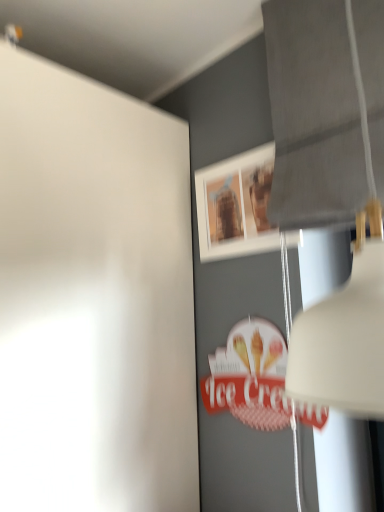
Question: In the image, is matte wooden picture frame at upper center positioned in front of or behind white matte lampshade at upper right?

Choices:
 (A) front
 (B) behind

Answer: (B)

Question: Is matte wooden picture frame at upper center bigger or smaller than white matte lampshade at upper right?

Choices:
 (A) big
 (B) small

Answer: (B)

Question: Looking at their shapes, would you say matte wooden picture frame at upper center is wider or thinner than white matte lampshade at upper right?

Choices:
 (A) thin
 (B) wide

Answer: (A)

Question: Choose the correct answer: Is white matte lampshade at upper right inside matte wooden picture frame at upper center or outside it?

Choices:
 (A) inside
 (B) outside

Answer: (B)

Question: From a real-world perspective, is white matte lampshade at upper right above or below matte wooden picture frame at upper center?

Choices:
 (A) above
 (B) below

Answer: (B)

Question: Is point (327, 163) positioned closer to the camera than point (289, 239)?

Choices:
 (A) farther
 (B) closer

Answer: (B)

Question: In terms of width, does white matte lampshade at upper right look wider or thinner when compared to matte wooden picture frame at upper center?

Choices:
 (A) thin
 (B) wide

Answer: (B)